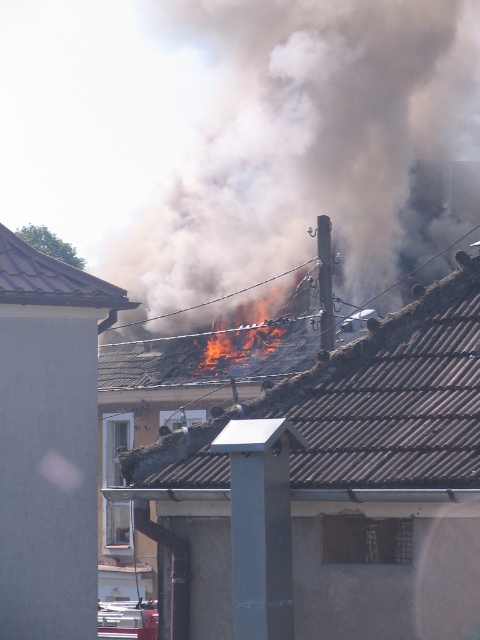
You are a firefighter trying to assess the fire scene. You notice a metallic tile roof at upper left. Can you determine its exact location in the image using coordinates?

The metallic tile roof at upper left is located at coordinates point (50, 280).